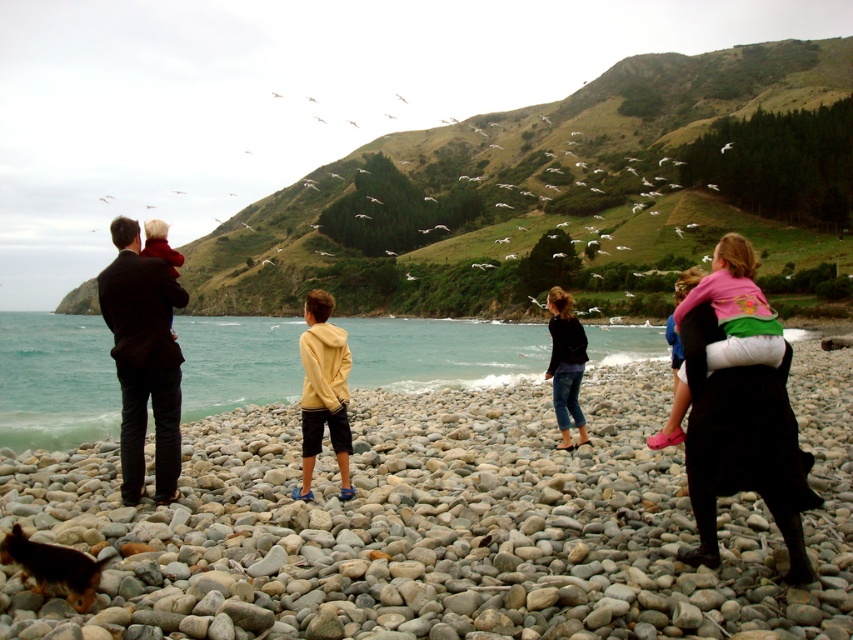
You are a photographer trying to capture the yellow matte hoodie at center and the smooth pebbles at center in the same frame. Based on their positions, which object would appear closer to the camera in the photo?

The yellow matte hoodie at center appears closer to the camera because it is positioned above the smooth pebbles at center, which are located below it.

From the picture: You are a photographer trying to capture the smooth pebbles at center and the yellow matte hoodie at center in the same frame. Based on their sizes, which object would appear larger in your photo?

The smooth pebbles at center would appear larger in the photo because they are bigger than the yellow matte hoodie at center according to the description.